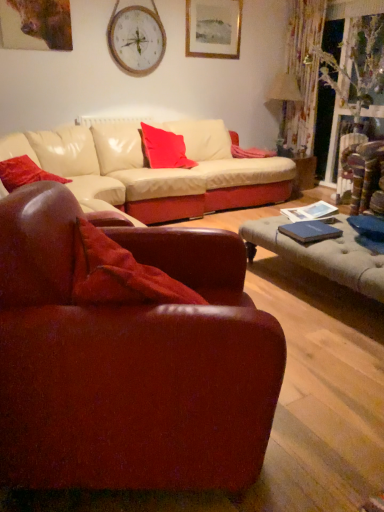
What is the approximate width of matte red pillow at left, placed as the second pillow when sorted from right to left?

The width of matte red pillow at left, placed as the second pillow when sorted from right to left, is 41.08 centimeters.

The height and width of the screenshot is (512, 384). What are the coordinates of `blue matte book at lower right` in the screenshot? It's located at 310,231.

Describe the element at coordinates (310, 231) in the screenshot. This screenshot has height=512, width=384. I see `blue matte book at lower right` at that location.

Measure the distance between point (x=205, y=444) and camera.

3.76 feet.

The height and width of the screenshot is (512, 384). Identify the location of wooden picture frame at upper center. (213, 28).

Describe the element at coordinates (213, 28) in the screenshot. Image resolution: width=384 pixels, height=512 pixels. I see `wooden picture frame at upper center` at that location.

The width and height of the screenshot is (384, 512). What do you see at coordinates (136, 39) in the screenshot?
I see `wooden clock at upper center` at bounding box center [136, 39].

The height and width of the screenshot is (512, 384). Identify the location of matte red pillow at left, the second pillow when ordered from top to bottom. (24, 173).

Measure the distance from wooden clock at upper center to matte red pillow at center, which is the 2th pillow in bottom-to-top order.

35.29 inches.

Could you tell me if wooden clock at upper center is turned towards matte red pillow at center, arranged as the 1th pillow when viewed from the back?

No, wooden clock at upper center is not turned towards matte red pillow at center, arranged as the 1th pillow when viewed from the back.

Does wooden clock at upper center have a larger size compared to matte red pillow at center, arranged as the 1th pillow when viewed from the back?

Actually, wooden clock at upper center might be smaller than matte red pillow at center, arranged as the 1th pillow when viewed from the back.

From the picture: Is wooden clock at upper center to the left or to the right of matte red pillow at center, the second pillow when ordered from left to right, in the image?

Based on their positions, wooden clock at upper center is located to the left of matte red pillow at center, the second pillow when ordered from left to right.

Can you tell me how much leather armchair at lower left and matte beige lampshade at upper right differ in facing direction?

The facing directions of leather armchair at lower left and matte beige lampshade at upper right are 79.2 degrees apart.

You are a GUI agent. You are given a task and a screenshot of the screen. Output one action in this format:
    pyautogui.click(x=<x>, y=<y>)
    Task: Click on the lamp to the right of leather armchair at lower left
    The image size is (384, 512).
    Given the screenshot: What is the action you would take?
    pyautogui.click(x=284, y=99)

Which object is closer to the camera taking this photo, leather armchair at lower left or matte beige lampshade at upper right?

leather armchair at lower left.

From the image's perspective, is wooden picture frame at upper center on leather armchair at lower left?

Yes, from the image's perspective, wooden picture frame at upper center is above leather armchair at lower left.

Between wooden picture frame at upper center and leather armchair at lower left, which one has less height?

wooden picture frame at upper center.

From a real-world perspective, is wooden picture frame at upper center positioned under leather armchair at lower left based on gravity?

No, from a real-world perspective, wooden picture frame at upper center is not below leather armchair at lower left.

Is point (226, 25) less distant than point (113, 462)?

No, it is not.

Between matte red pillow at center, marked as the second pillow in a front-to-back arrangement, and blue matte book at lower right, which one has less height?

Standing shorter between the two is blue matte book at lower right.

Which object is thinner, matte red pillow at center, the first pillow positioned from the right, or blue matte book at lower right?

With smaller width is blue matte book at lower right.

The image size is (384, 512). Identify the location of pad in front of the matte red pillow at center, marked as the second pillow in a front-to-back arrangement. (310, 231).

Find the location of a particular element. The width and height of the screenshot is (384, 512). pad below the wooden picture frame at upper center (from a real-world perspective) is located at coordinates (310, 231).

Based on the photo, is blue matte book at lower right smaller than wooden picture frame at upper center?

Yes.

Considering the sizes of objects blue matte book at lower right and wooden picture frame at upper center in the image provided, who is shorter, blue matte book at lower right or wooden picture frame at upper center?

blue matte book at lower right.

Is blue matte book at lower right next to wooden picture frame at upper center and touching it?

They are not placed beside each other.

Can matte beige lampshade at upper right be found inside matte red pillow at left, placed as the second pillow when sorted from right to left?

No.

Can you see matte red pillow at left, marked as the first pillow in a front-to-back arrangement, touching matte beige lampshade at upper right?

No, matte red pillow at left, marked as the first pillow in a front-to-back arrangement, is not beside matte beige lampshade at upper right.

How many degrees apart are the facing directions of matte red pillow at left, marked as the first pillow in a front-to-back arrangement, and matte beige lampshade at upper right?

The angle between the facing direction of matte red pillow at left, marked as the first pillow in a front-to-back arrangement, and the facing direction of matte beige lampshade at upper right is 61.2 degrees.

Considering the sizes of objects matte red pillow at left, the 1th pillow when ordered from left to right, and matte beige lampshade at upper right in the image provided, who is smaller, matte red pillow at left, the 1th pillow when ordered from left to right, or matte beige lampshade at upper right?

Smaller between the two is matte red pillow at left, the 1th pillow when ordered from left to right.

Which of these two, matte red pillow at left, placed as the second pillow when sorted from right to left, or leather armchair at lower left, stands taller?

With more height is leather armchair at lower left.

Is matte red pillow at left, which is the 1th pillow from bottom to top, to the left of leather armchair at lower left from the viewer's perspective?

Correct, you'll find matte red pillow at left, which is the 1th pillow from bottom to top, to the left of leather armchair at lower left.

From a real-world perspective, is matte red pillow at left, placed as the second pillow when sorted from right to left, located higher than leather armchair at lower left?

Yes, from a real-world perspective, matte red pillow at left, placed as the second pillow when sorted from right to left, is over leather armchair at lower left

Are matte red pillow at left, the second pillow when ordered from top to bottom, and leather armchair at lower left far apart?

Absolutely, matte red pillow at left, the second pillow when ordered from top to bottom, is distant from leather armchair at lower left.

From the wooden clock at upper center, count 1st pillows forward and point to it. Please provide its 2D coordinates.

[(164, 149)]

This screenshot has height=512, width=384. I want to click on lamp to the right of leather armchair at lower left, so click(x=284, y=99).

Considering their positions, is wooden clock at upper center positioned further to leather armchair at lower left than matte red pillow at left, marked as the first pillow in a front-to-back arrangement?

wooden clock at upper center is further to leather armchair at lower left.

Looking at this image, estimate the real-world distances between objects in this image. Which object is further from wooden picture frame at upper center, blue matte book at lower right or matte red pillow at center, the second pillow when ordered from left to right?

Based on the image, blue matte book at lower right appears to be further to wooden picture frame at upper center.

Looking at the image, which one is located closer to matte red pillow at center, the first pillow positioned from the right, blue matte book at lower right or wooden clock at upper center?

wooden clock at upper center.

Based on their spatial positions, is matte beige lampshade at upper right or blue matte book at lower right closer to matte red pillow at center, marked as the second pillow in a front-to-back arrangement?

Among the two, blue matte book at lower right is located nearer to matte red pillow at center, marked as the second pillow in a front-to-back arrangement.

From the image, which object appears to be farther from wooden picture frame at upper center, matte beige lampshade at upper right or matte red pillow at left, the second pillow in the back-to-front sequence?

Based on the image, matte red pillow at left, the second pillow in the back-to-front sequence, appears to be further to wooden picture frame at upper center.

Estimate the real-world distances between objects in this image. Which object is closer to leather armchair at lower left, matte beige lampshade at upper right or blue matte book at lower right?

Based on the image, blue matte book at lower right appears to be nearer to leather armchair at lower left.

Considering their positions, is wooden picture frame at upper center positioned further to matte beige lampshade at upper right than wooden clock at upper center?

The object further to matte beige lampshade at upper right is wooden clock at upper center.

Estimate the real-world distances between objects in this image. Which object is further from blue matte book at lower right, wooden clock at upper center or leather armchair at lower left?

wooden clock at upper center.

The height and width of the screenshot is (512, 384). What are the coordinates of `clock located between blue matte book at lower right and matte beige lampshade at upper right in the depth direction` in the screenshot? It's located at (136, 39).

Where is `picture frame between blue matte book at lower right and matte beige lampshade at upper right in the front-back direction`? Image resolution: width=384 pixels, height=512 pixels. picture frame between blue matte book at lower right and matte beige lampshade at upper right in the front-back direction is located at coordinates (213, 28).

In order to click on pillow between wooden clock at upper center and matte beige lampshade at upper right from left to right in this screenshot , I will do `click(164, 149)`.

Identify the location of clock that lies between wooden picture frame at upper center and matte red pillow at center, the first pillow positioned from the right, from top to bottom. This screenshot has width=384, height=512. (136, 39).